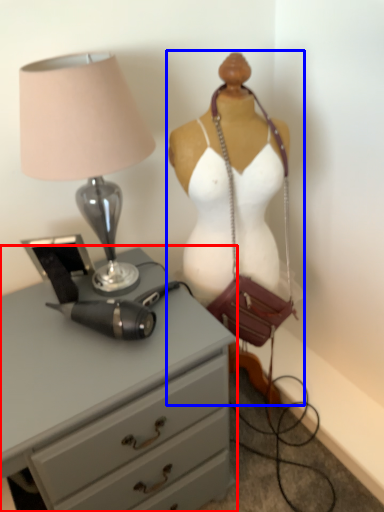
Question: Which of the following is the farthest to the observer, chest of drawers (highlighted by a red box) or mannequin (highlighted by a blue box)?

Choices:
 (A) chest of drawers
 (B) mannequin

Answer: (B)